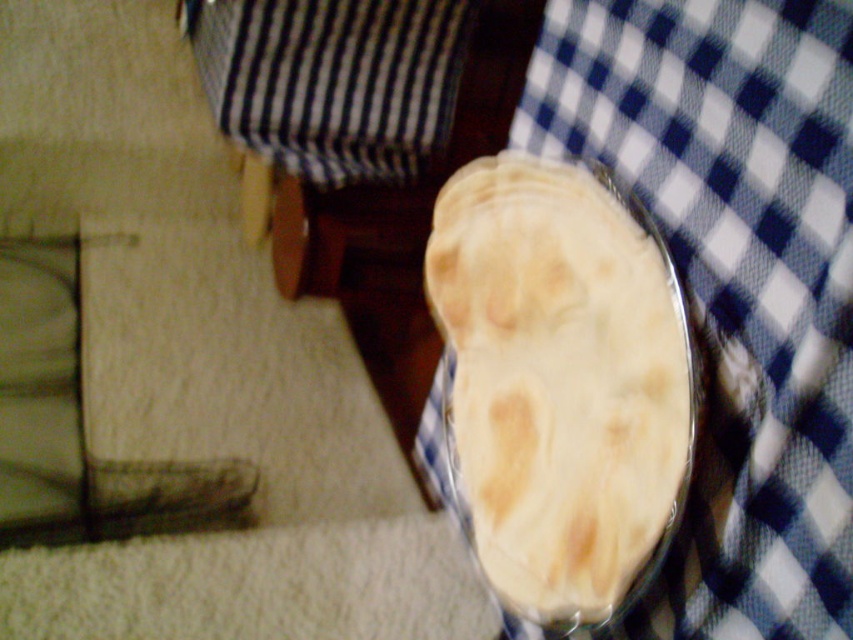
Between blue checkered tablecloth at upper right and black striped fabric at upper center, which one appears on the right side from the viewer's perspective?

blue checkered tablecloth at upper right

You are a GUI agent. You are given a task and a screenshot of the screen. Output one action in this format:
    pyautogui.click(x=<x>, y=<y>)
    Task: Click on the blue checkered tablecloth at upper right
    The height and width of the screenshot is (640, 853).
    Given the screenshot: What is the action you would take?
    pyautogui.click(x=734, y=278)

In the scene shown: Between blue checkered tablecloth at upper right and white matte flatbread at center, which one has more height?

blue checkered tablecloth at upper right

Can you confirm if blue checkered tablecloth at upper right is positioned to the right of white matte flatbread at center?

Correct, you'll find blue checkered tablecloth at upper right to the right of white matte flatbread at center.

At what (x,y) coordinates should I click in order to perform the action: click on blue checkered tablecloth at upper right. Please return your answer as a coordinate pair (x, y). Looking at the image, I should click on (734, 278).

Where is `blue checkered tablecloth at upper right`? This screenshot has width=853, height=640. blue checkered tablecloth at upper right is located at coordinates (734, 278).

Looking at this image, can you confirm if black striped fabric at upper center is positioned below white matte flatbread at center?

No, black striped fabric at upper center is not below white matte flatbread at center.

The height and width of the screenshot is (640, 853). Describe the element at coordinates (363, 145) in the screenshot. I see `black striped fabric at upper center` at that location.

Locate an element on the screen. Image resolution: width=853 pixels, height=640 pixels. black striped fabric at upper center is located at coordinates (363, 145).